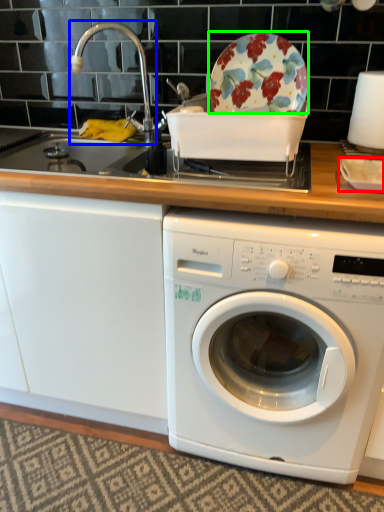
Question: Considering the real-world distances, which object is closest to tableware (highlighted by a red box)? faucet (highlighted by a blue box) or table (highlighted by a green box).

Choices:
 (A) faucet
 (B) table

Answer: (B)